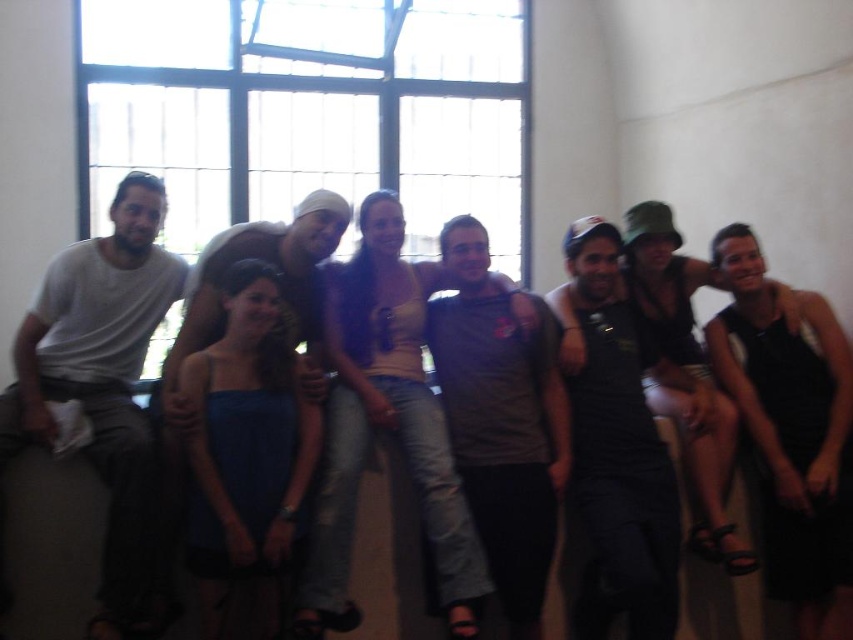
The image size is (853, 640). What are the coordinates of `clear glass window at upper center` in the screenshot? It's located at (311, 109).

Between clear glass window at upper center and black matte tank top at center, which one appears on the right side from the viewer's perspective?

From the viewer's perspective, black matte tank top at center appears more on the right side.

Who is more forward, (291, 182) or (582, 492)?

Point (582, 492) is more forward.

Find the location of a particular element. The height and width of the screenshot is (640, 853). clear glass window at upper center is located at coordinates (311, 109).

Based on the photo, is white cotton t-shirt at left behind gray matte t-shirt at center?

No.

Does white cotton t-shirt at left have a greater height compared to gray matte t-shirt at center?

No.

Identify the location of white cotton t-shirt at left. (102, 380).

Is point (294, 44) farther from viewer compared to point (292, 275)?

Yes, point (294, 44) is farther from viewer.

Can you confirm if clear glass window at upper center is smaller than matte brown shirt at center?

No, clear glass window at upper center is not smaller than matte brown shirt at center.

The height and width of the screenshot is (640, 853). Find the location of `clear glass window at upper center`. clear glass window at upper center is located at coordinates point(311,109).

Where is `clear glass window at upper center`? clear glass window at upper center is located at coordinates (311, 109).